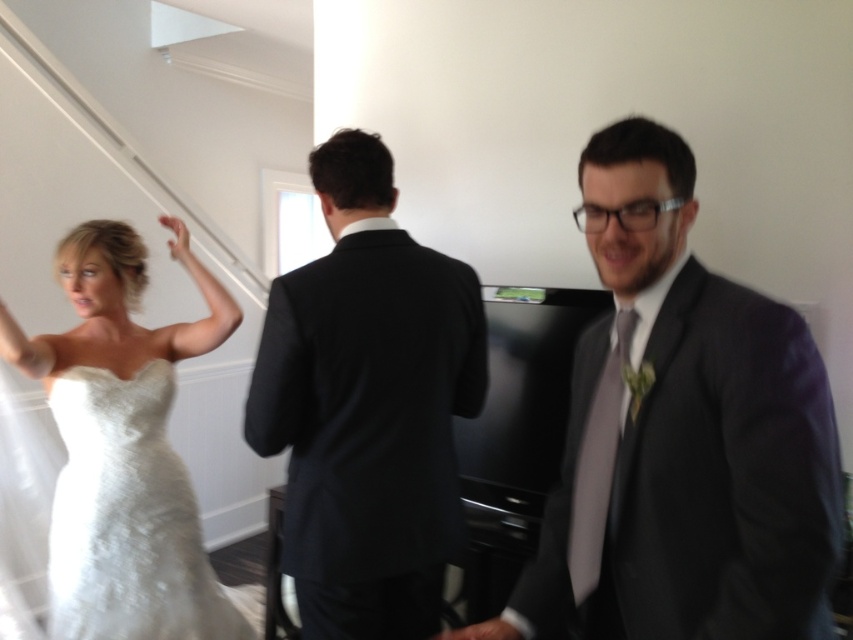
Question: Is matte gray suit at center in front of satin white dress at left?

Choices:
 (A) yes
 (B) no

Answer: (A)

Question: Does matte gray suit at center appear on the right side of dark suit at center?

Choices:
 (A) no
 (B) yes

Answer: (B)

Question: Which object appears farthest from the camera in this image?

Choices:
 (A) matte gray suit at center
 (B) satin white dress at left

Answer: (B)

Question: Which of the following is the closest to the observer?

Choices:
 (A) (71, 298)
 (B) (425, 600)

Answer: (B)

Question: From the image, what is the correct spatial relationship of matte gray suit at center in relation to satin white dress at left?

Choices:
 (A) left
 (B) right

Answer: (B)

Question: Estimate the real-world distances between objects in this image. Which object is farther from the satin white dress at left?

Choices:
 (A) dark suit at center
 (B) matte gray suit at center

Answer: (B)